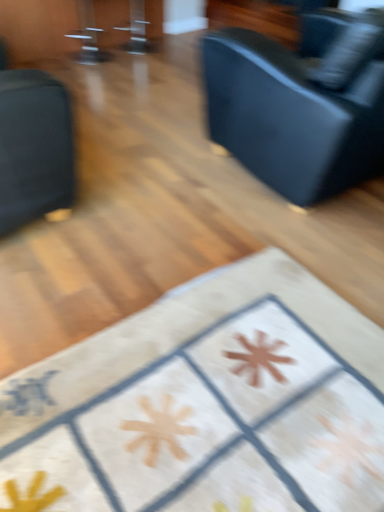
The height and width of the screenshot is (512, 384). Find the location of `white fabric rug at center, which ranks as the 1th furniture in bottom-to-top order`. white fabric rug at center, which ranks as the 1th furniture in bottom-to-top order is located at coordinates (207, 404).

Measure the distance between point (x=127, y=429) and camera.

Point (x=127, y=429) and camera are 1.28 meters apart from each other.

This screenshot has width=384, height=512. What do you see at coordinates (300, 106) in the screenshot?
I see `black leather couch at upper right` at bounding box center [300, 106].

Where is `matte black couch at left, marked as the 1th furniture in a left-to-right arrangement`? matte black couch at left, marked as the 1th furniture in a left-to-right arrangement is located at coordinates (34, 147).

The image size is (384, 512). Identify the location of white fabric rug at center, which ranks as the 1th furniture in bottom-to-top order. (x=207, y=404).

Consider the image. Could black leather couch at upper right be considered to be inside matte black couch at left, the second furniture when ordered from bottom to top?

No, black leather couch at upper right is located outside of matte black couch at left, the second furniture when ordered from bottom to top.

Can you confirm if matte black couch at left, placed as the first furniture when sorted from top to bottom, is positioned to the right of black leather couch at upper right?

No.

How far apart are matte black couch at left, the second furniture when ordered from bottom to top, and black leather couch at upper right?

A distance of 99.30 centimeters exists between matte black couch at left, the second furniture when ordered from bottom to top, and black leather couch at upper right.

Considering the relative sizes of matte black couch at left, the second furniture when ordered from bottom to top, and black leather couch at upper right in the image provided, is matte black couch at left, the second furniture when ordered from bottom to top, bigger than black leather couch at upper right?

No.

Image resolution: width=384 pixels, height=512 pixels. In order to click on studio couch above the white fabric rug at center, which ranks as the second furniture in top-to-bottom order (from the image's perspective) in this screenshot , I will do `click(300, 106)`.

Is black leather couch at upper right taller or shorter than white fabric rug at center, which ranks as the 1th furniture in bottom-to-top order?

black leather couch at upper right is taller than white fabric rug at center, which ranks as the 1th furniture in bottom-to-top order.

In the scene shown: From a real-world perspective, is black leather couch at upper right on top of white fabric rug at center, the first furniture in the right-to-left sequence?

Yes.

Who is more distant, black leather couch at upper right or white fabric rug at center, which ranks as the second furniture in top-to-bottom order?

black leather couch at upper right is behind.

Between matte black couch at left, the second furniture when ordered from bottom to top, and white fabric rug at center, marked as the 2th furniture in a left-to-right arrangement, which one has less height?

With less height is white fabric rug at center, marked as the 2th furniture in a left-to-right arrangement.

Measure the distance from matte black couch at left, placed as the first furniture when sorted from top to bottom, to white fabric rug at center, which ranks as the 1th furniture in bottom-to-top order.

The distance of matte black couch at left, placed as the first furniture when sorted from top to bottom, from white fabric rug at center, which ranks as the 1th furniture in bottom-to-top order, is 37.21 inches.

Considering the sizes of objects matte black couch at left, placed as the first furniture when sorted from top to bottom, and white fabric rug at center, the first furniture in the right-to-left sequence, in the image provided, who is wider, matte black couch at left, placed as the first furniture when sorted from top to bottom, or white fabric rug at center, the first furniture in the right-to-left sequence,?

white fabric rug at center, the first furniture in the right-to-left sequence.

Which is in front, point (53, 164) or point (236, 273)?

Positioned in front is point (53, 164).

Is white fabric rug at center, the first furniture in the right-to-left sequence, looking in the opposite direction of black leather couch at upper right?

No, black leather couch at upper right is not at the back of white fabric rug at center, the first furniture in the right-to-left sequence.

Is white fabric rug at center, which ranks as the second furniture in top-to-bottom order, at the left side of black leather couch at upper right?

Yes.

Is white fabric rug at center, marked as the 2th furniture in a left-to-right arrangement, next to black leather couch at upper right and touching it?

No, white fabric rug at center, marked as the 2th furniture in a left-to-right arrangement, is not in contact with black leather couch at upper right.

Is white fabric rug at center, the first furniture in the right-to-left sequence, wider than black leather couch at upper right?

No.

Considering the relative sizes of white fabric rug at center, which ranks as the 1th furniture in bottom-to-top order, and matte black couch at left, marked as the 1th furniture in a left-to-right arrangement, in the image provided, is white fabric rug at center, which ranks as the 1th furniture in bottom-to-top order, wider than matte black couch at left, marked as the 1th furniture in a left-to-right arrangement,?

Yes, white fabric rug at center, which ranks as the 1th furniture in bottom-to-top order, is wider than matte black couch at left, marked as the 1th furniture in a left-to-right arrangement.

How different are the orientations of white fabric rug at center, which ranks as the 1th furniture in bottom-to-top order, and matte black couch at left, marked as the 1th furniture in a left-to-right arrangement, in degrees?

The angle between the facing direction of white fabric rug at center, which ranks as the 1th furniture in bottom-to-top order, and the facing direction of matte black couch at left, marked as the 1th furniture in a left-to-right arrangement, is 92.2 degrees.

Which is in front, white fabric rug at center, the first furniture in the right-to-left sequence, or matte black couch at left, the second furniture in the right-to-left sequence?

white fabric rug at center, the first furniture in the right-to-left sequence, is more forward.

Where is `furniture in front of the matte black couch at left, placed as the first furniture when sorted from top to bottom`? The image size is (384, 512). furniture in front of the matte black couch at left, placed as the first furniture when sorted from top to bottom is located at coordinates (207, 404).

Considering the sizes of objects black leather couch at upper right and matte black couch at left, the second furniture when ordered from bottom to top, in the image provided, who is bigger, black leather couch at upper right or matte black couch at left, the second furniture when ordered from bottom to top,?

black leather couch at upper right is bigger.

From a real-world perspective, who is located higher, black leather couch at upper right or matte black couch at left, placed as the first furniture when sorted from top to bottom?

In real-world perspective, black leather couch at upper right is above.

Based on the photo, is black leather couch at upper right located outside matte black couch at left, the second furniture when ordered from bottom to top?

Indeed, black leather couch at upper right is completely outside matte black couch at left, the second furniture when ordered from bottom to top.

How different are the orientations of black leather couch at upper right and matte black couch at left, marked as the 1th furniture in a left-to-right arrangement, in degrees?

The angle between the facing direction of black leather couch at upper right and the facing direction of matte black couch at left, marked as the 1th furniture in a left-to-right arrangement, is 89.9 degrees.

Image resolution: width=384 pixels, height=512 pixels. What are the coordinates of `studio couch behind the matte black couch at left, placed as the first furniture when sorted from top to bottom` in the screenshot? It's located at (300, 106).

At what (x,y) coordinates should I click in order to perform the action: click on studio couch above the white fabric rug at center, which ranks as the 1th furniture in bottom-to-top order (from a real-world perspective). Please return your answer as a coordinate pair (x, y). The height and width of the screenshot is (512, 384). Looking at the image, I should click on (300, 106).

Considering their positions, is white fabric rug at center, which ranks as the second furniture in top-to-bottom order, positioned closer to black leather couch at upper right than matte black couch at left, the second furniture when ordered from bottom to top?

matte black couch at left, the second furniture when ordered from bottom to top, lies closer to black leather couch at upper right than the other object.

Which object lies further to the anchor point matte black couch at left, placed as the first furniture when sorted from top to bottom, black leather couch at upper right or white fabric rug at center, marked as the 2th furniture in a left-to-right arrangement?

Based on the image, black leather couch at upper right appears to be further to matte black couch at left, placed as the first furniture when sorted from top to bottom.

Which object lies nearer to the anchor point black leather couch at upper right, matte black couch at left, the second furniture in the right-to-left sequence, or white fabric rug at center, the first furniture in the right-to-left sequence?

matte black couch at left, the second furniture in the right-to-left sequence, is positioned closer to the anchor black leather couch at upper right.

Considering their positions, is black leather couch at upper right positioned further to white fabric rug at center, which ranks as the second furniture in top-to-bottom order, than matte black couch at left, the second furniture in the right-to-left sequence?

The object further to white fabric rug at center, which ranks as the second furniture in top-to-bottom order, is black leather couch at upper right.

Based on their spatial positions, is white fabric rug at center, the first furniture in the right-to-left sequence, or black leather couch at upper right closer to matte black couch at left, the second furniture in the right-to-left sequence?

The object closer to matte black couch at left, the second furniture in the right-to-left sequence, is white fabric rug at center, the first furniture in the right-to-left sequence.

Looking at the image, which one is located further to white fabric rug at center, marked as the 2th furniture in a left-to-right arrangement, matte black couch at left, placed as the first furniture when sorted from top to bottom, or black leather couch at upper right?

black leather couch at upper right is further to white fabric rug at center, marked as the 2th furniture in a left-to-right arrangement.

At what (x,y) coordinates should I click in order to perform the action: click on furniture between matte black couch at left, the second furniture in the right-to-left sequence, and black leather couch at upper right from left to right. Please return your answer as a coordinate pair (x, y). The height and width of the screenshot is (512, 384). Looking at the image, I should click on (207, 404).